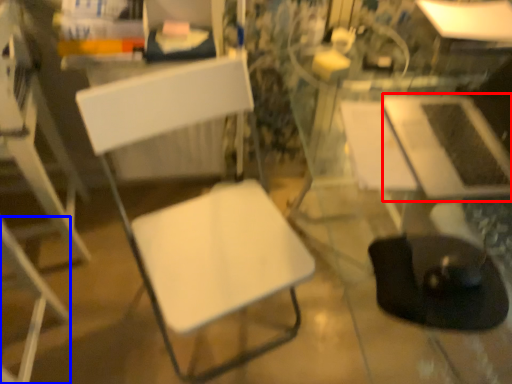
Question: Which object appears farthest to the camera in this image, table (highlighted by a red box) or chair (highlighted by a blue box)?

Choices:
 (A) table
 (B) chair

Answer: (A)